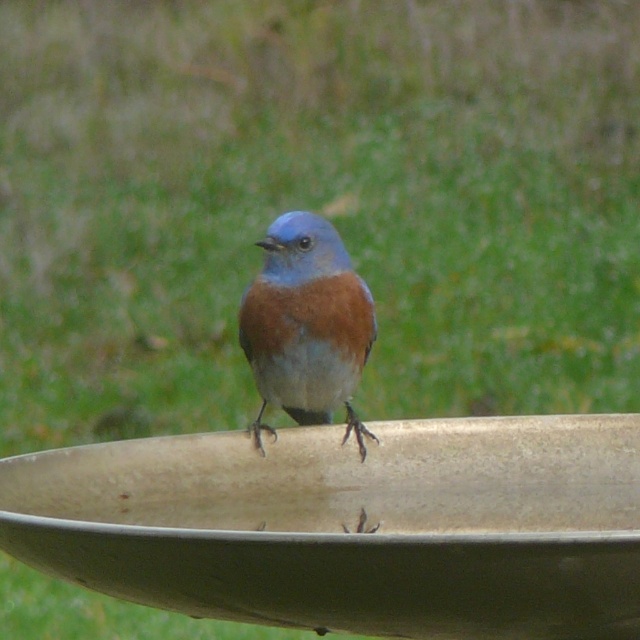
You are standing in a garden and see the beige ceramic bird bath at center. If you want to place a small flower pot that is 1 meter tall next to it, will the flower pot be taller than the bird bath?

The beige ceramic bird bath at center is 99.39 centimeters from viewer, so the flower pot at 1 meter tall will be slightly taller than the bird bath.

In the scene shown: You are a photographer trying to capture the blue glossy bird at center while avoiding the beige ceramic bird bath at center from blocking the view. Can you position yourself in a way that the bird is visible without the bath obstructing it?

The beige ceramic bird bath at center is in front of the blue glossy bird at center, so it will block the view. Move to a position where you can see around or behind the bird bath to capture the bird without obstruction.